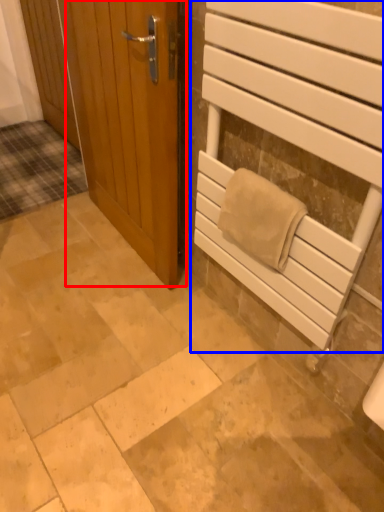
Question: Which object is further to the camera taking this photo, door (highlighted by a red box) or elevator (highlighted by a blue box)?

Choices:
 (A) door
 (B) elevator

Answer: (A)